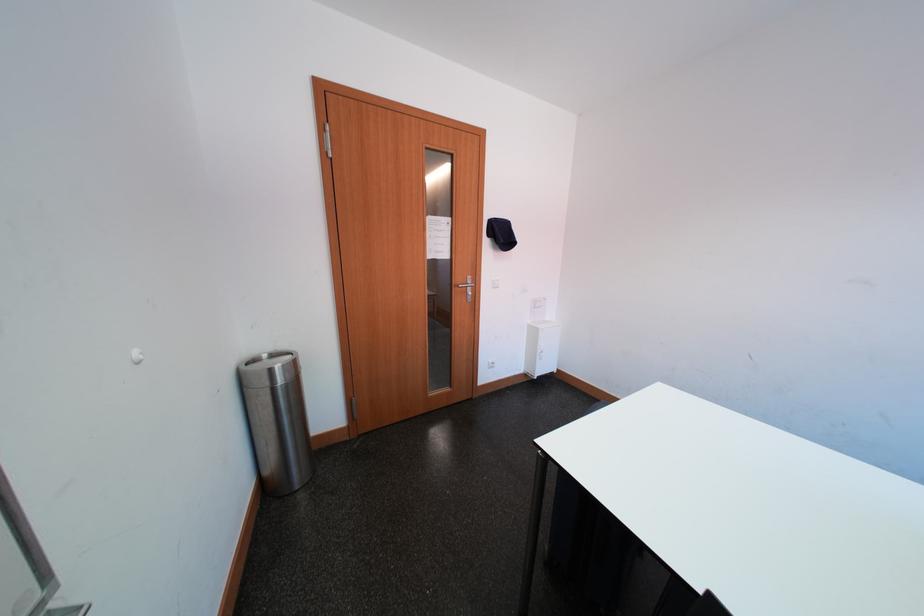
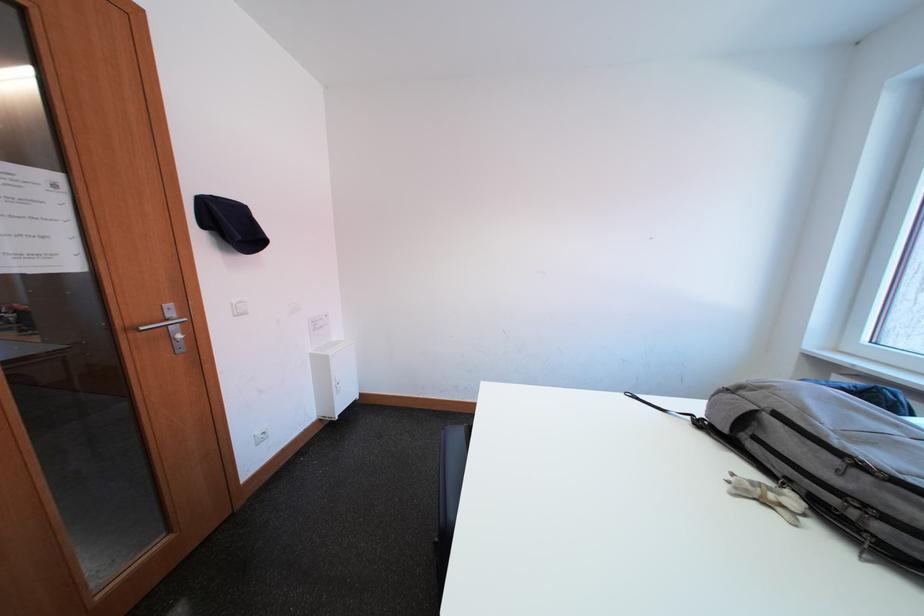
Question: The camera is either moving clockwise (left) or counter-clockwise (right) around the object. The first image is from the beginning of the video and the second image is from the end. Is the camera moving left or right when shooting the video?

Choices:
 (A) Left
 (B) Right

Answer: (A)